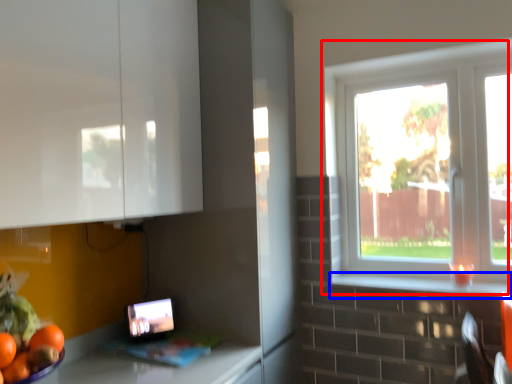
Question: Which of the following is the closest to the observer, window (highlighted by a red box) or window sill (highlighted by a blue box)?

Choices:
 (A) window
 (B) window sill

Answer: (B)